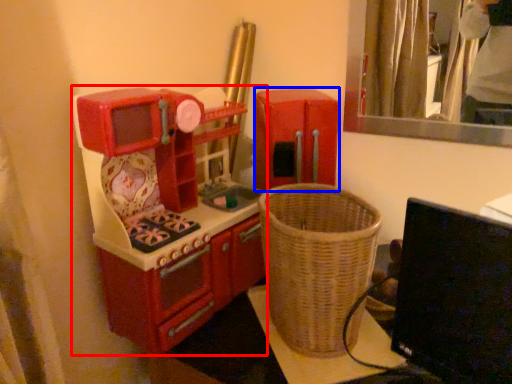
Question: Which object appears farthest to the camera in this image, appliance (highlighted by a red box) or appliance (highlighted by a blue box)?

Choices:
 (A) appliance
 (B) appliance

Answer: (B)